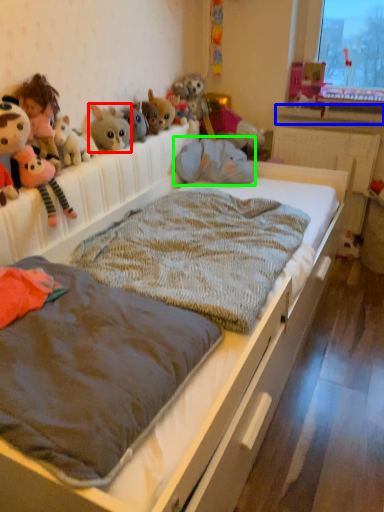
Question: Which is farther away from toy (highlighted by a red box)? window sill (highlighted by a blue box) or animal (highlighted by a green box)?

Choices:
 (A) window sill
 (B) animal

Answer: (A)